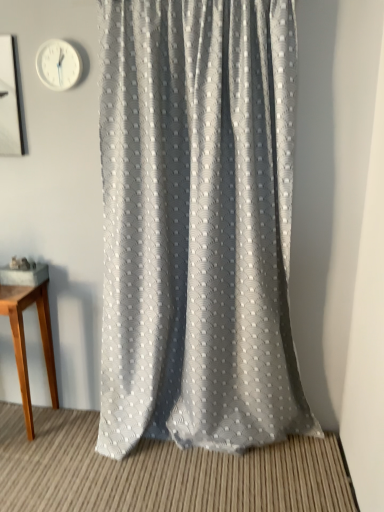
Find the location of `free spot in front of light brown wooden table at left`. free spot in front of light brown wooden table at left is located at coordinates (23, 461).